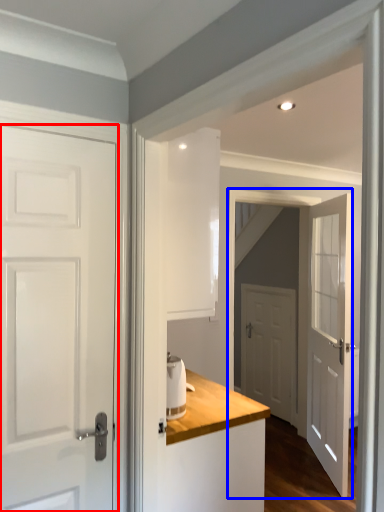
Question: Which point is further to the camera, door (highlighted by a red box) or screen door (highlighted by a blue box)?

Choices:
 (A) door
 (B) screen door

Answer: (B)